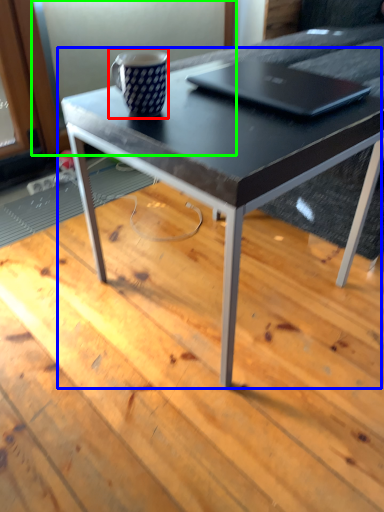
Question: Which object is positioned closest to coffee cup (highlighted by a red box)? Select from coffee table (highlighted by a blue box) and screen door (highlighted by a green box).

Choices:
 (A) coffee table
 (B) screen door

Answer: (A)